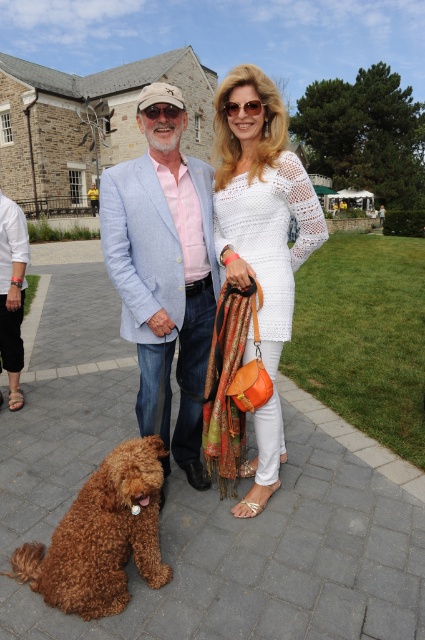
Question: Is light blue textured blazer at center thinner than brown fluffy dog at lower left?

Choices:
 (A) yes
 (B) no

Answer: (A)

Question: Among these points, which one is farthest from the camera?

Choices:
 (A) (99, 547)
 (B) (218, 209)

Answer: (B)

Question: Does light blue textured blazer at center appear over white crochet dress at center?

Choices:
 (A) yes
 (B) no

Answer: (B)

Question: Which point is closer to the camera?

Choices:
 (A) (195, 172)
 (B) (67, 579)

Answer: (B)

Question: Which of the following is the closest to the observer?

Choices:
 (A) light blue textured blazer at center
 (B) brown fluffy dog at lower left

Answer: (B)

Question: Considering the relative positions of light blue textured blazer at center and white crochet dress at center in the image provided, where is light blue textured blazer at center located with respect to white crochet dress at center?

Choices:
 (A) right
 (B) left

Answer: (B)